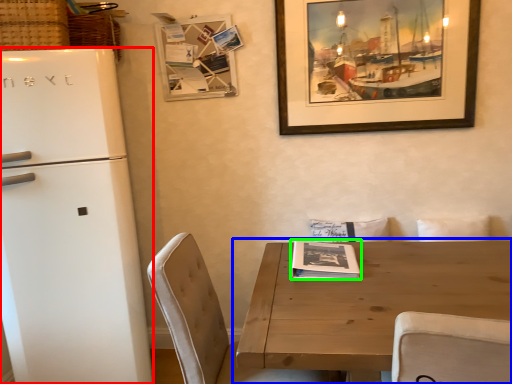
Question: Which object is the farthest from refrigerator (highlighted by a red box)? Choose among these: table (highlighted by a blue box) or magazine (highlighted by a green box).

Choices:
 (A) table
 (B) magazine

Answer: (A)